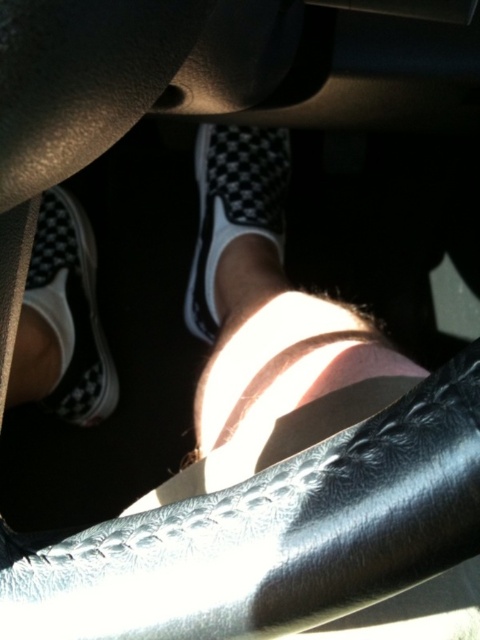
Question: Among these objects, which one is nearest to the camera?

Choices:
 (A) checkerboard fabric shoe at lower left
 (B) black checkered slip-on shoe at center

Answer: (A)

Question: Can you confirm if checkerboard fabric shoe at lower left is positioned above black checkered slip-on shoe at center?

Choices:
 (A) no
 (B) yes

Answer: (A)

Question: Can you confirm if checkerboard fabric shoe at lower left is positioned above black checkered slip-on shoe at center?

Choices:
 (A) yes
 (B) no

Answer: (B)

Question: Which of the following is the farthest from the observer?

Choices:
 (A) (231, 154)
 (B) (91, 241)

Answer: (B)

Question: Can you confirm if checkerboard fabric shoe at lower left is thinner than black checkered slip-on shoe at center?

Choices:
 (A) yes
 (B) no

Answer: (A)